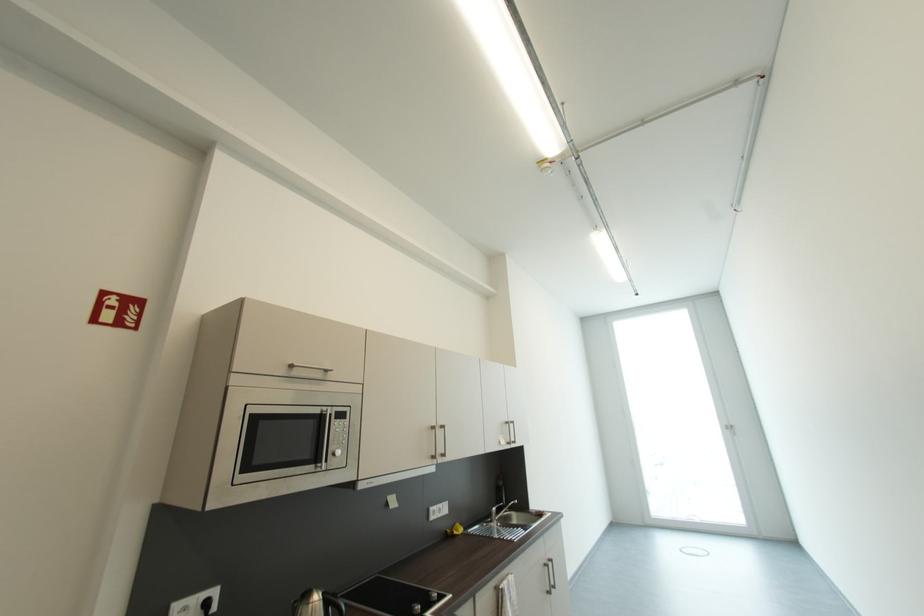
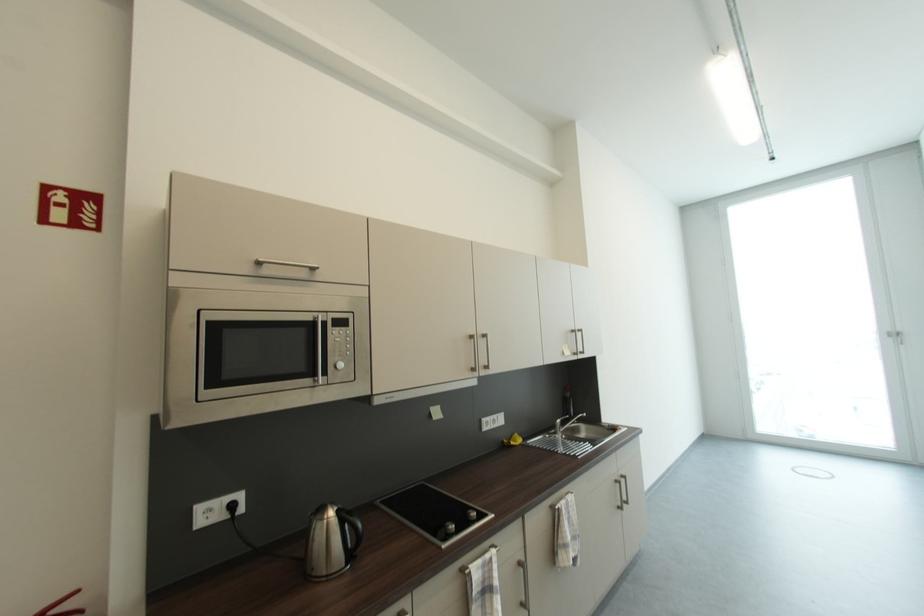
Which direction would the cameraman need to move to produce the second image?

The cameraman moved toward right, forward.